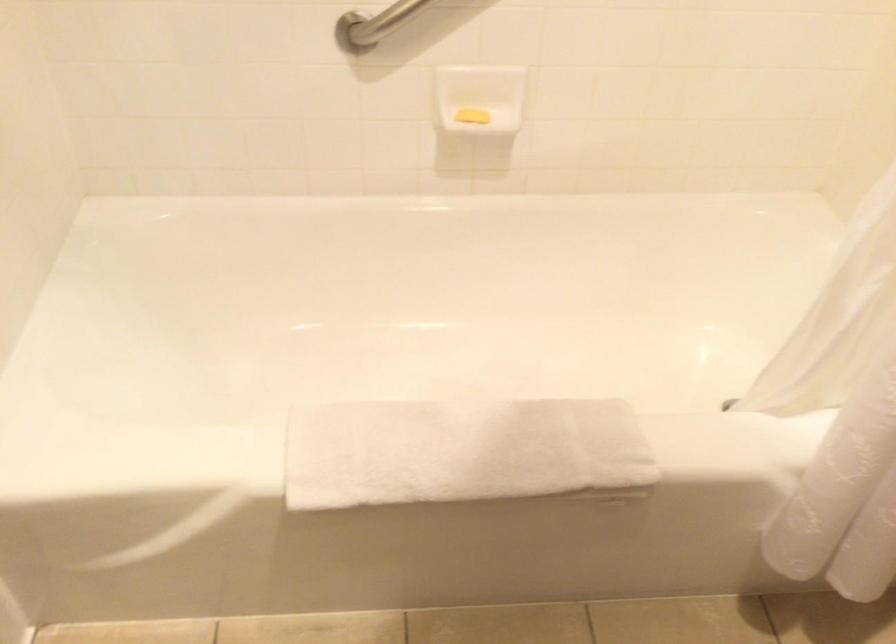
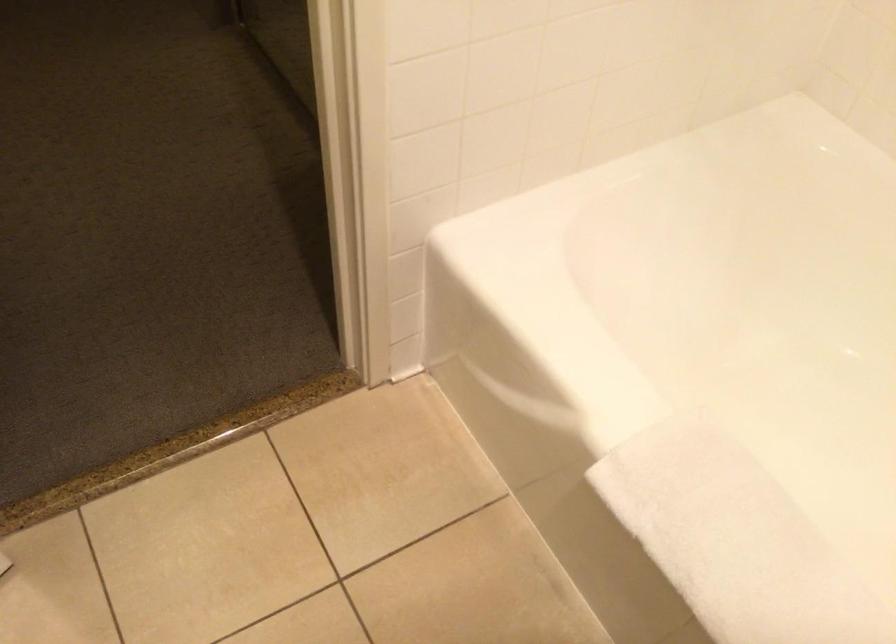
Where in the second image is the point corresponding to point (403, 447) from the first image?

(736, 541)